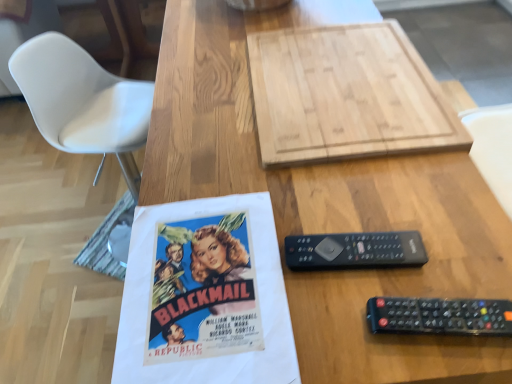
Locate an element on the screen. The height and width of the screenshot is (384, 512). vacant area that lies between black plastic remote at lower right and natural wood cutting board at upper center is located at coordinates point(397,222).